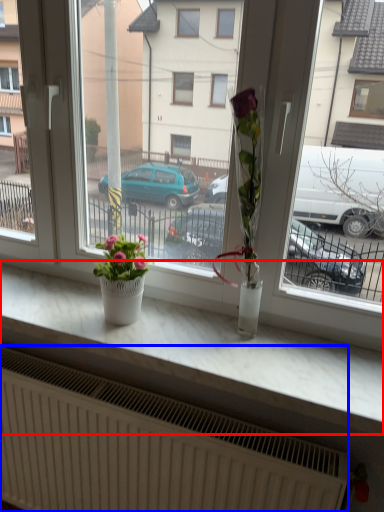
Question: Which object is further to the camera taking this photo, counter top (highlighted by a red box) or radiator (highlighted by a blue box)?

Choices:
 (A) counter top
 (B) radiator

Answer: (B)